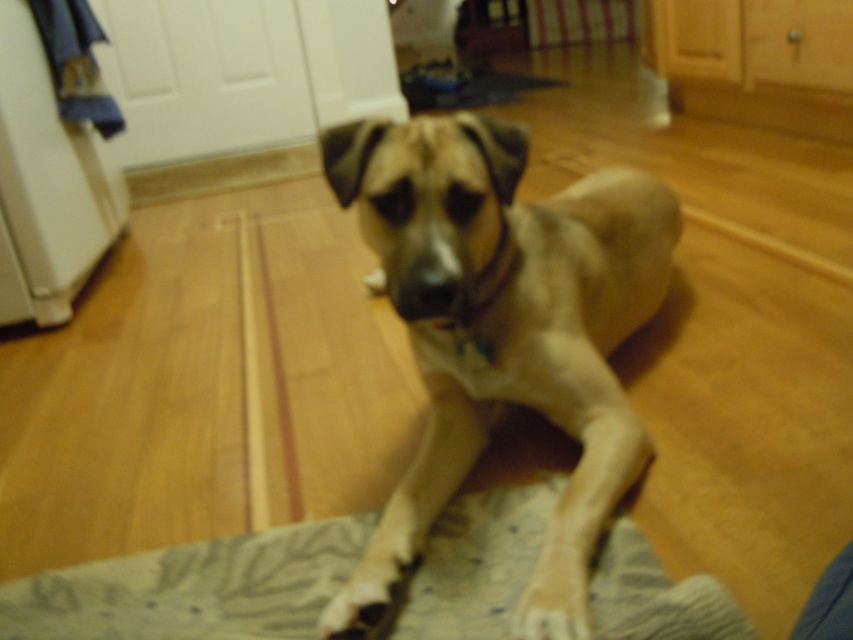
You are a pet sitter who needs to ensure the tan smooth dog at center can stand up comfortably. Given the space between the dog and the textured gray mat at lower center, is there enough room for the dog to move without bumping into the mat?

The tan smooth dog at center is much taller than the textured gray mat at lower center, so there should be sufficient vertical space for the dog to stand up without hitting the mat. However, the horizontal distance between them isn

You are standing in the room where the dog is lying. You want to place a small toy exactly at the point labeled as point (502, 332). Where on the dog will the toy land?

The point (502, 332) corresponds to the tan smooth dog at center, so placing the toy there would land it directly on the dog.